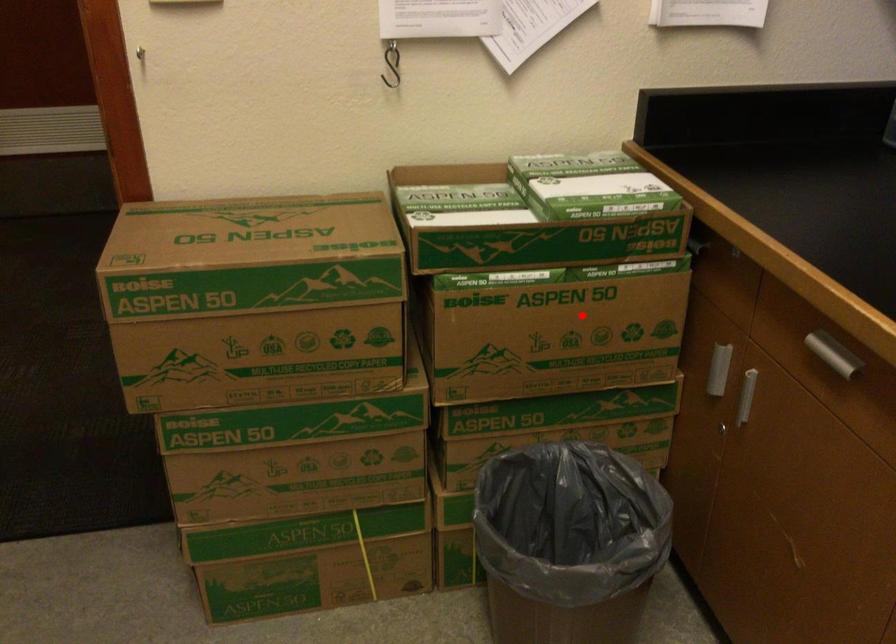
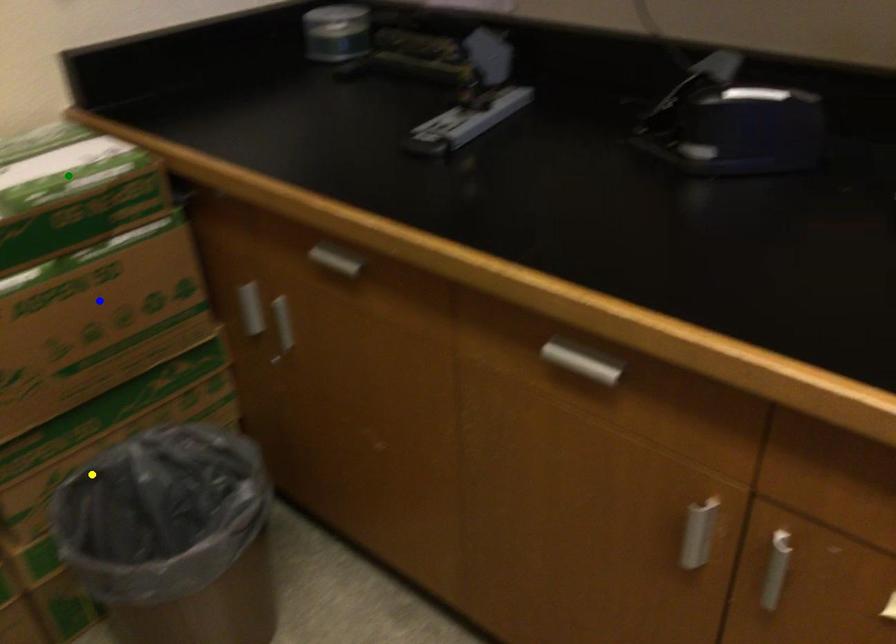
Question: I am providing you with two images of the same scene from different viewpoints. A red point is marked on the first image. You are given multiple points on the second image. Which mark in image 2 goes with the point in image 1?

Choices:
 (A) green point
 (B) blue point
 (C) yellow point

Answer: (B)